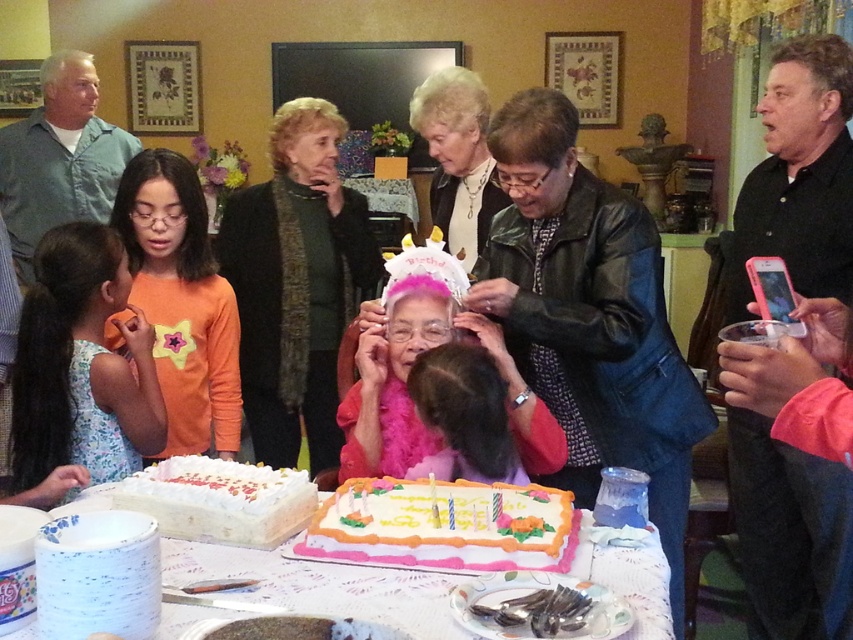
Question: Which of the following is the farthest from the observer?

Choices:
 (A) (432, 259)
 (B) (154, 252)

Answer: (B)

Question: Which point is closer to the camera taking this photo?

Choices:
 (A) (216, 524)
 (B) (415, 547)
 (C) (445, 326)

Answer: (B)

Question: Is white frosted cake with floral decorations at center to the right of white frosted cake at lower left from the viewer's perspective?

Choices:
 (A) no
 (B) yes

Answer: (B)

Question: Among these points, which one is nearest to the camera?

Choices:
 (A) (248, 323)
 (B) (335, 545)
 (C) (235, 448)
 (D) (38, 445)

Answer: (B)

Question: Is white frosted cake with floral decorations at center positioned behind white frosted cake at lower left?

Choices:
 (A) yes
 (B) no

Answer: (B)

Question: Is dark green sweater at center to the left of floral dress at lower left from the viewer's perspective?

Choices:
 (A) yes
 (B) no

Answer: (B)